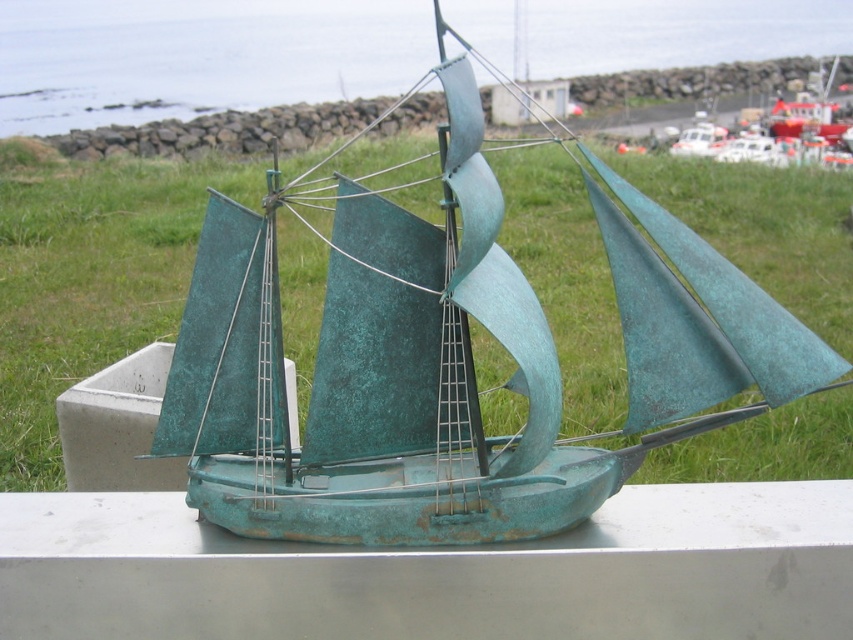
Who is more forward, (x=173, y=205) or (x=364, y=13)?

Point (x=173, y=205) is in front.

Does green grass at center have a greater width compared to green patina water at upper center?

In fact, green grass at center might be narrower than green patina water at upper center.

This screenshot has width=853, height=640. I want to click on green grass at center, so click(90, 284).

Does point (33, 589) lie in front of point (393, 4)?

Yes.

Can you confirm if smooth concrete ledge at center is thinner than green patina water at upper center?

Yes, smooth concrete ledge at center is thinner than green patina water at upper center.

Image resolution: width=853 pixels, height=640 pixels. What do you see at coordinates (438, 572) in the screenshot? I see `smooth concrete ledge at center` at bounding box center [438, 572].

Find the location of `smooth concrete ledge at center`. smooth concrete ledge at center is located at coordinates (438, 572).

Which is below, green grass at center or smooth concrete ledge at center?

smooth concrete ledge at center

How distant is green grass at center from smooth concrete ledge at center?

green grass at center and smooth concrete ledge at center are 12.94 feet apart.

What are the coordinates of `green grass at center` in the screenshot? It's located at (90, 284).